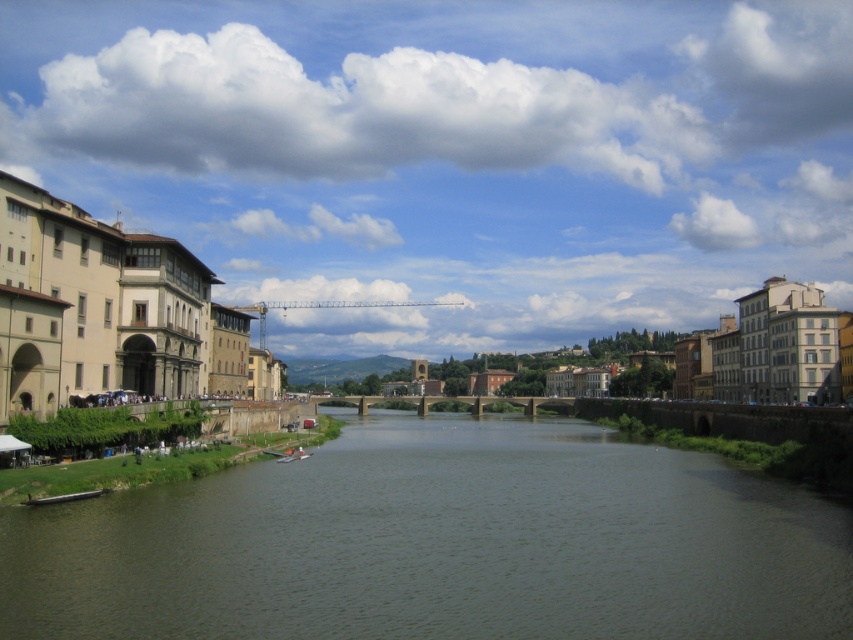
Question: Which object appears closest to the camera in this image?

Choices:
 (A) wooden boat at lower left
 (B) brown concrete river at center

Answer: (B)

Question: Can you confirm if brown concrete river at center is bigger than wooden boat at lower left?

Choices:
 (A) no
 (B) yes

Answer: (B)

Question: In this image, where is brown concrete river at center located relative to wooden boat at lower left?

Choices:
 (A) left
 (B) right

Answer: (B)

Question: Is brown concrete river at center behind wooden boat at lower left?

Choices:
 (A) yes
 (B) no

Answer: (B)